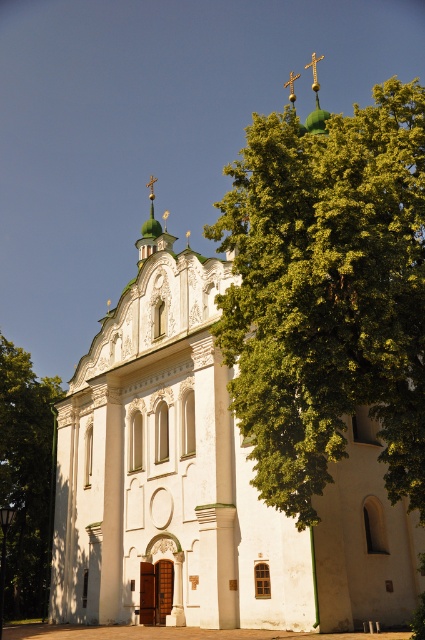
Does green leafy tree at upper right come behind green leafy tree at left?

→ No, it is not.

Can you confirm if green leafy tree at upper right is positioned above green leafy tree at left?

Yes.

Is point (291, 195) positioned after point (28, 566)?

No, it is not.

Identify the location of green leafy tree at upper right. The image size is (425, 640). (328, 292).

Who is more distant from viewer, [294,509] or [153,220]?

The point [153,220] is behind.

Does point (416, 369) lie behind point (161, 234)?

No, (416, 369) is in front of (161, 234).

The width and height of the screenshot is (425, 640). In order to click on green leafy tree at upper right in this screenshot , I will do `click(328, 292)`.

Is white stone church at center below green leafy tree at left?

Actually, white stone church at center is above green leafy tree at left.

Can you confirm if white stone church at center is positioned to the right of green leafy tree at left?

Yes, white stone church at center is to the right of green leafy tree at left.

Who is more distant from viewer, (x=380, y=605) or (x=22, y=353)?

The point (x=22, y=353) is behind.

Where is `white stone church at center`? white stone church at center is located at coordinates (206, 486).